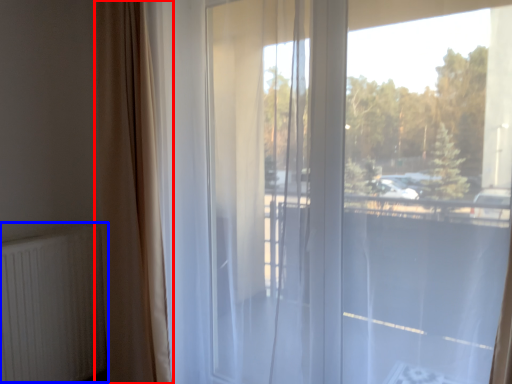
Question: Which point is further to the camera, curtain (highlighted by a red box) or radiator (highlighted by a blue box)?

Choices:
 (A) curtain
 (B) radiator

Answer: (B)